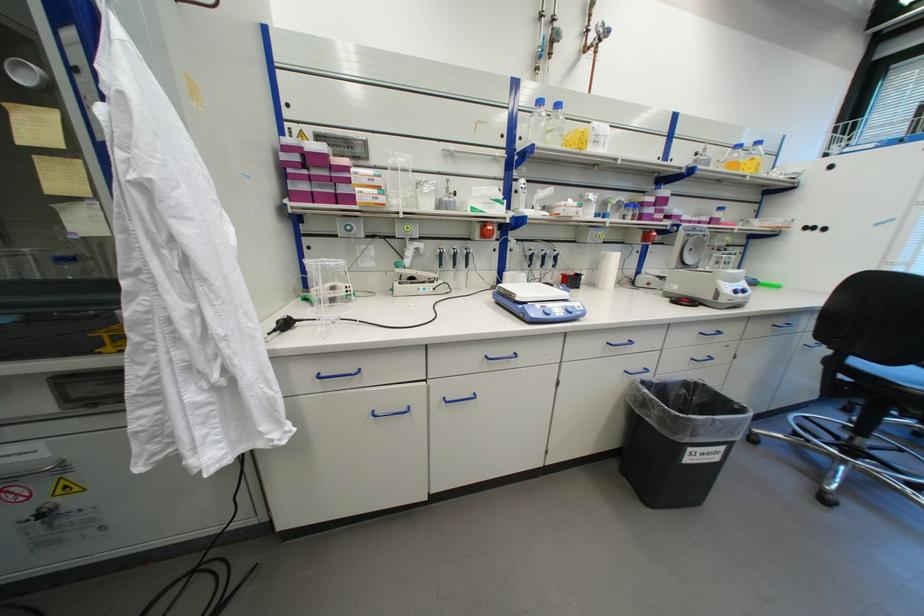
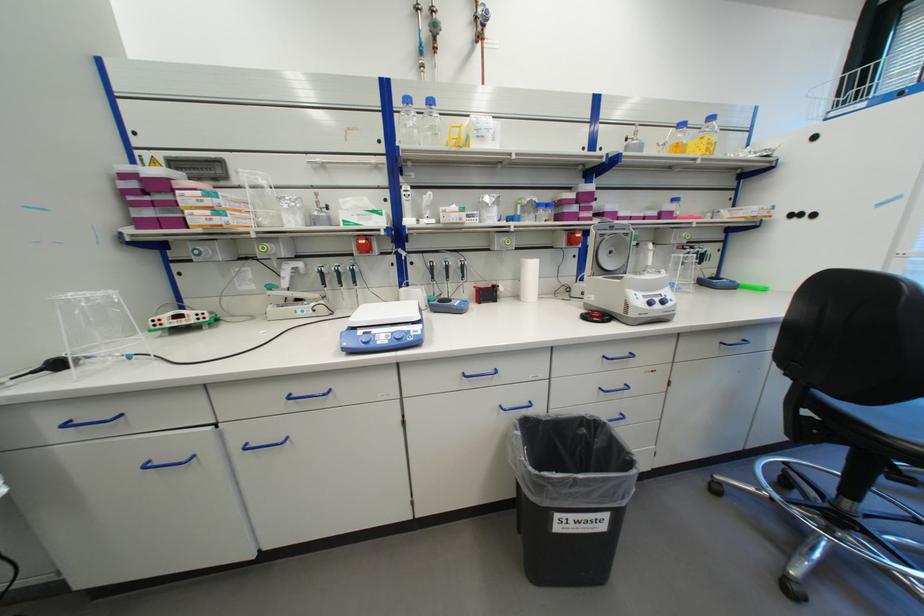
Find the pixel in the second image that matches the point at 326,378 in the first image.

(75, 426)